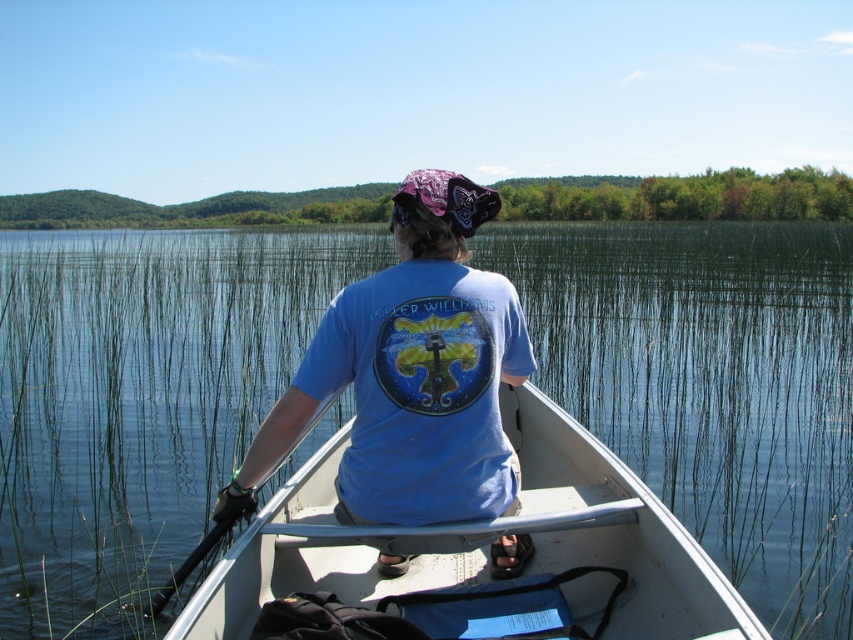
You are standing at point (57, 378) and want to reach the canoe. The distance between you and the canoe is 43.66 feet. If you can walk 10 feet per minute, how many minutes will it take you to reach the canoe?

The distance between you and the canoe is 43.66 feet. At a walking speed of 10 feet per minute, it will take approximately 4.366 minutes to reach the canoe.

You are a photographer planning to take a portrait of the person in the canoe. You want to ensure the blue cotton shirt at center is visible but also want to include the clear water at center in the background. Based on their positions, which side of the shirt should you focus on to include both elements?

The clear water at center is to the left of the blue cotton shirt at center. To include both the blue cotton shirt at center and the clear water at center in the background, focus on the left side of the shirt since the water is positioned there.